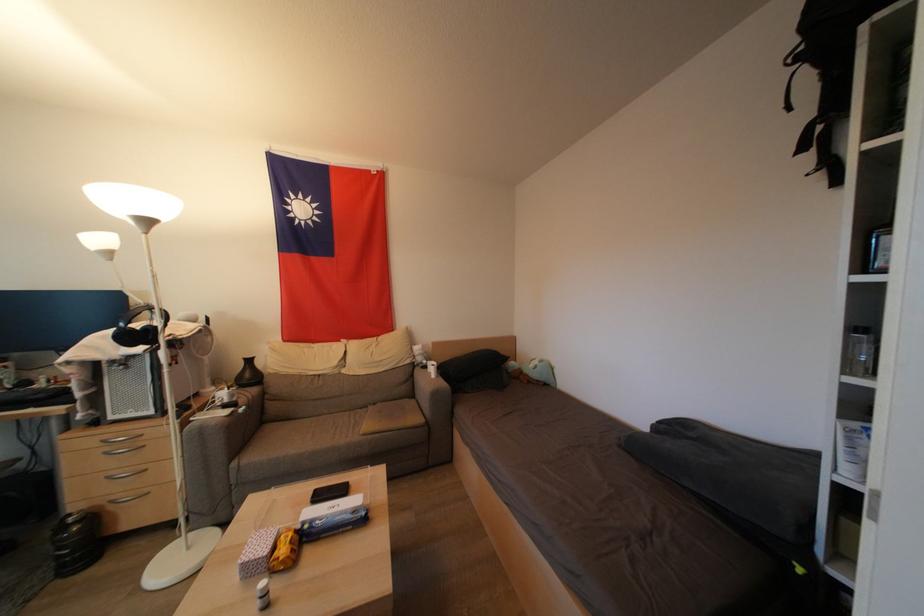
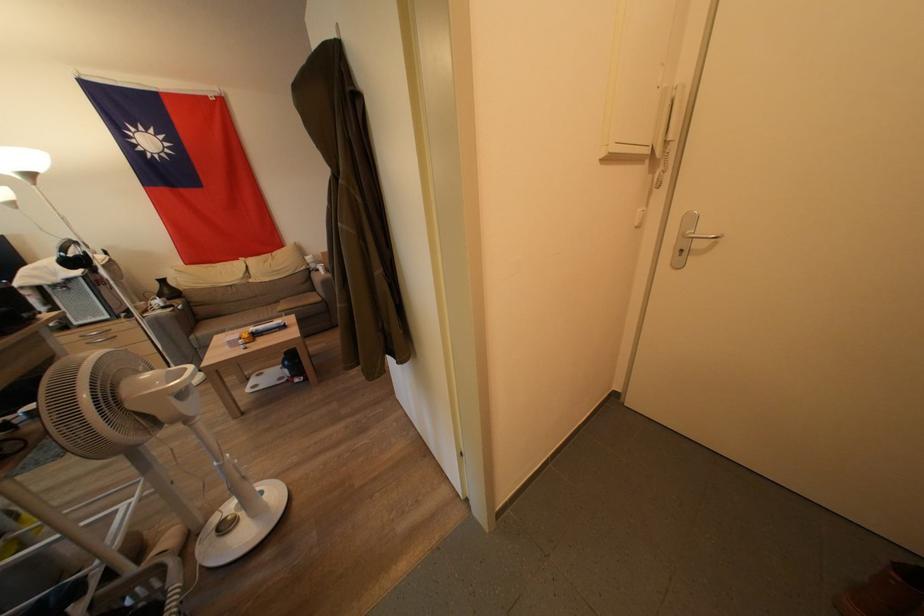
Find the pixel in the second image that matches (116,421) in the first image.

(81, 328)